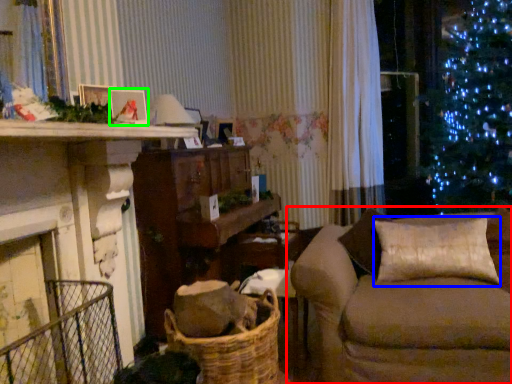
Question: Which is nearer to the studio couch (highlighted by a red box)? pillow (highlighted by a blue box) or picture frame (highlighted by a green box).

Choices:
 (A) pillow
 (B) picture frame

Answer: (A)